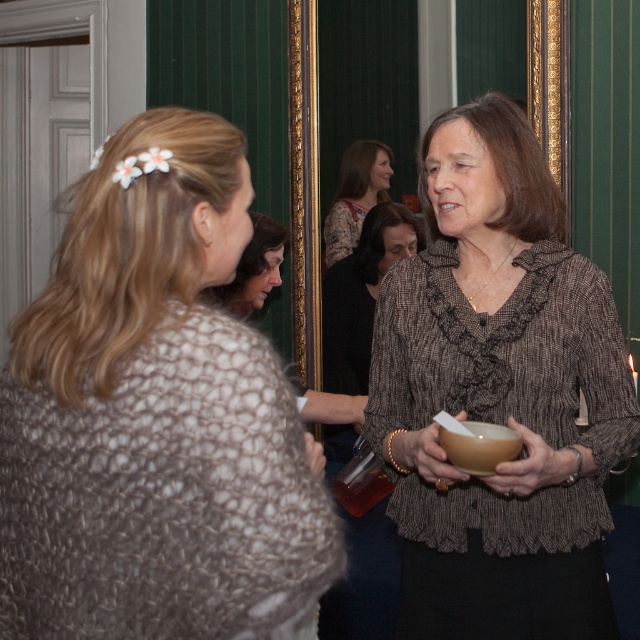
Question: Does brown textured blouse at center come behind floral-patterned blouse at center?

Choices:
 (A) yes
 (B) no

Answer: (B)

Question: Which point is closer to the camera taking this photo?

Choices:
 (A) (360, 202)
 (B) (548, 572)

Answer: (B)

Question: Where is brown textured blouse at center located in relation to matte black hair at center in the image?

Choices:
 (A) right
 (B) left

Answer: (A)

Question: Considering the real-world distances, which object is closest to the brown textured blouse at center?

Choices:
 (A) floral-patterned blouse at center
 (B) knitted beige sweater at center
 (C) matte black hair at center

Answer: (B)

Question: Is knitted beige sweater at center to the left of brown textured blouse at center from the viewer's perspective?

Choices:
 (A) yes
 (B) no

Answer: (A)

Question: Which point appears farthest from the camera in this image?

Choices:
 (A) (268, 230)
 (B) (132, 132)
 (C) (461, 403)
 (D) (342, 248)

Answer: (D)